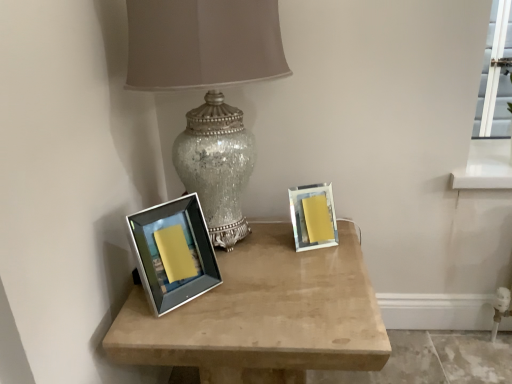
Locate an element on the screen. This screenshot has width=512, height=384. vacant area to the left of matte silver picture frame at right, the first picture frame viewed from the back is located at coordinates (261, 245).